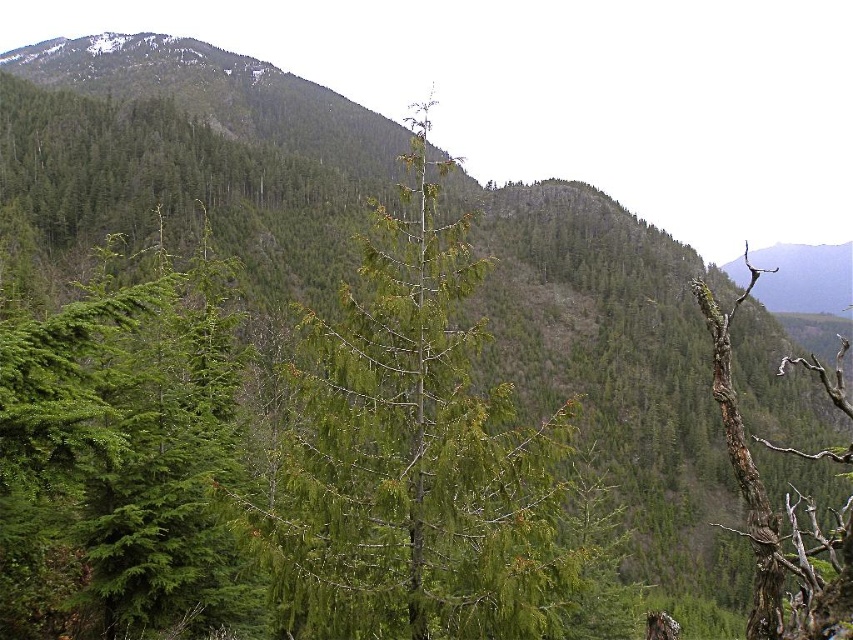
You are a hiker standing at the base of the mountain. You notice a point marked at coordinates [119,452]. Which object in the scene does this coordinate point to?

The point at coordinates [119,452] corresponds to the green matte tree at left.